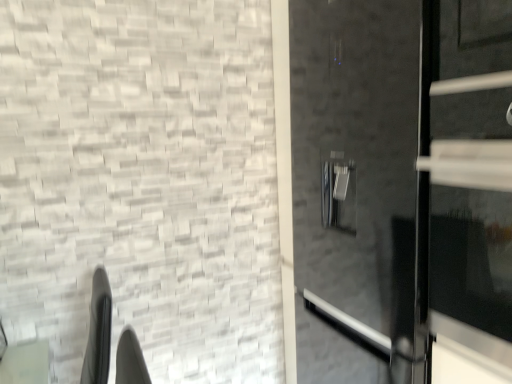
Question: From the image's perspective, is black glass door at right, the 2th door when ordered from back to front, positioned above or below glossy black door at right, which is counted as the second door, starting from the front?

Choices:
 (A) below
 (B) above

Answer: (B)

Question: Does point (431, 94) appear closer or farther from the camera than point (351, 231)?

Choices:
 (A) farther
 (B) closer

Answer: (B)

Question: In the image, is black glass door at right, the 2th door when ordered from back to front, on the left side or the right side of glossy black door at right, which is the 1th door from back to front?

Choices:
 (A) right
 (B) left

Answer: (B)

Question: From a real-world perspective, is glossy black door at right, which is the 1th door from back to front, above or below black glass door at right, which is the 1th door from front to back?

Choices:
 (A) below
 (B) above

Answer: (A)

Question: In the image, is glossy black door at right, which is counted as the second door, starting from the front, on the left side or the right side of black glass door at right, the 2th door when ordered from back to front?

Choices:
 (A) right
 (B) left

Answer: (A)

Question: Considering the positions of glossy black door at right, which is counted as the second door, starting from the front, and black glass door at right, which is the 1th door from front to back, in the image, is glossy black door at right, which is counted as the second door, starting from the front, wider or thinner than black glass door at right, which is the 1th door from front to back,?

Choices:
 (A) thin
 (B) wide

Answer: (B)

Question: Is glossy black door at right, which is the 1th door from back to front, inside or outside of black glass door at right, the 2th door when ordered from back to front?

Choices:
 (A) outside
 (B) inside

Answer: (A)